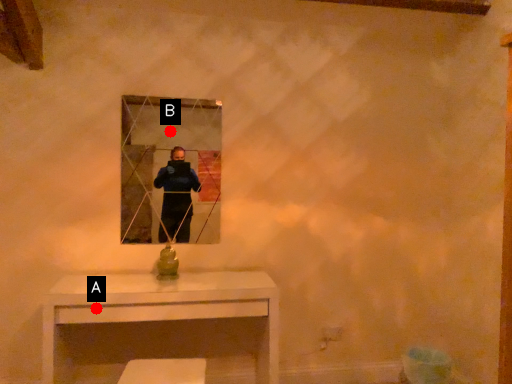
Question: Two points are circled on the image, labeled by A and B beside each circle. Which point is closer to the camera?

Choices:
 (A) A is closer
 (B) B is closer

Answer: (A)